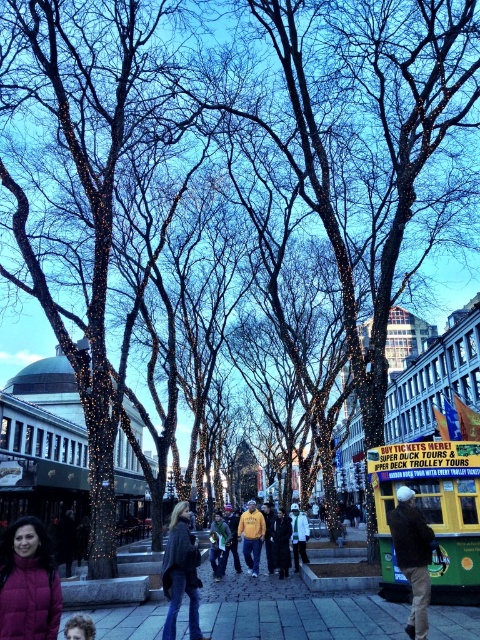
Question: Which point appears farthest from the camera in this image?

Choices:
 (A) (172, 608)
 (B) (240, 520)
 (C) (84, 632)

Answer: (B)

Question: Can you confirm if dark gray stone pavement at lower left is smaller than yellow hoodie at center?

Choices:
 (A) yes
 (B) no

Answer: (B)

Question: Which object is positioned farthest from the white matte jacket at center?

Choices:
 (A) dark gray stone pavement at lower left
 (B) green fabric jacket at center
 (C) matte yellow hoodie at center
 (D) purple puffer jacket at lower left

Answer: (D)

Question: Can you confirm if purple puffer jacket at lower left is bigger than yellow hoodie at center?

Choices:
 (A) no
 (B) yes

Answer: (A)

Question: Can you confirm if white matte jacket at center is positioned below curly hair at center?

Choices:
 (A) no
 (B) yes

Answer: (B)

Question: Which of the following is the closest to the observer?

Choices:
 (A) yellow hoodie at center
 (B) green fabric jacket at center
 (C) purple puffer jacket at lower left

Answer: (C)